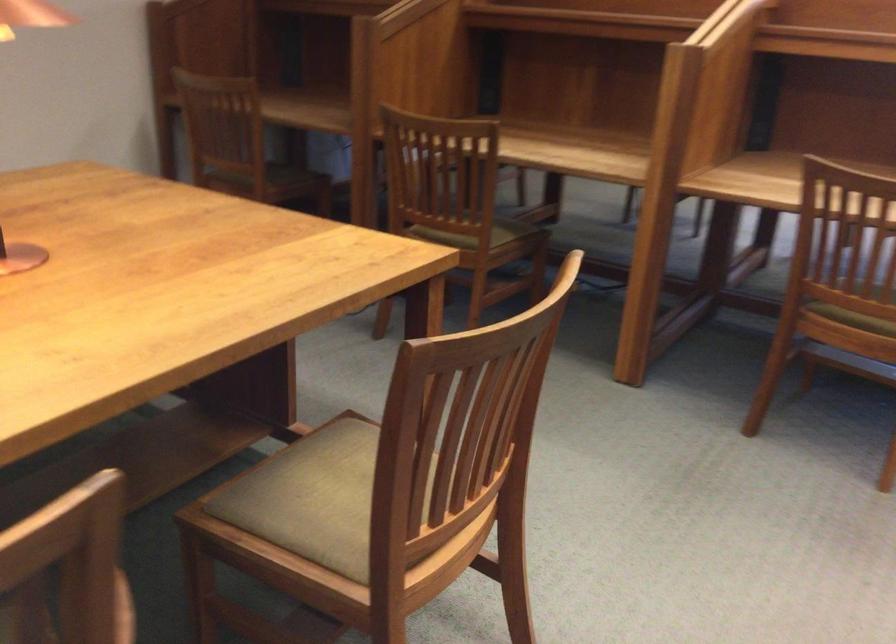
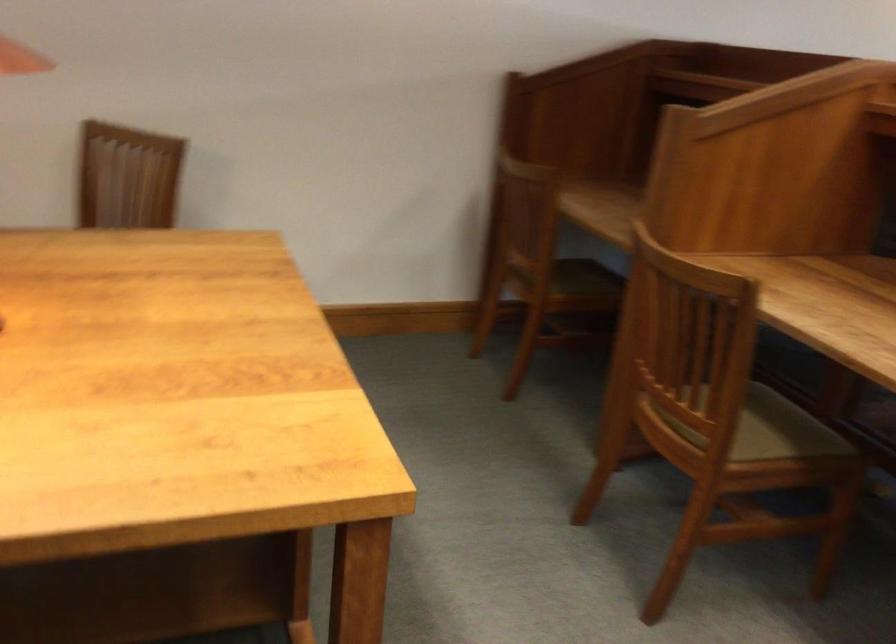
In the second image, find the point that corresponds to [273,165] in the first image.

(572, 277)